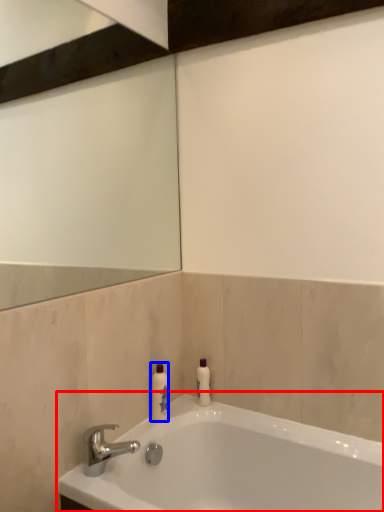
Question: Which point is closer to the camera, bathtub (highlighted by a red box) or toiletry (highlighted by a blue box)?

Choices:
 (A) bathtub
 (B) toiletry

Answer: (A)